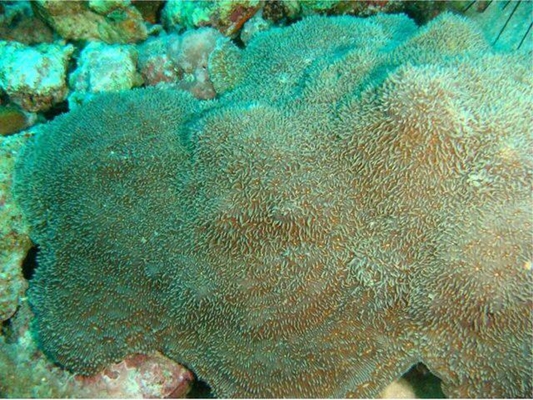
Locate an element on the screen. This screenshot has height=400, width=533. wooden floor is located at coordinates (508, 18).